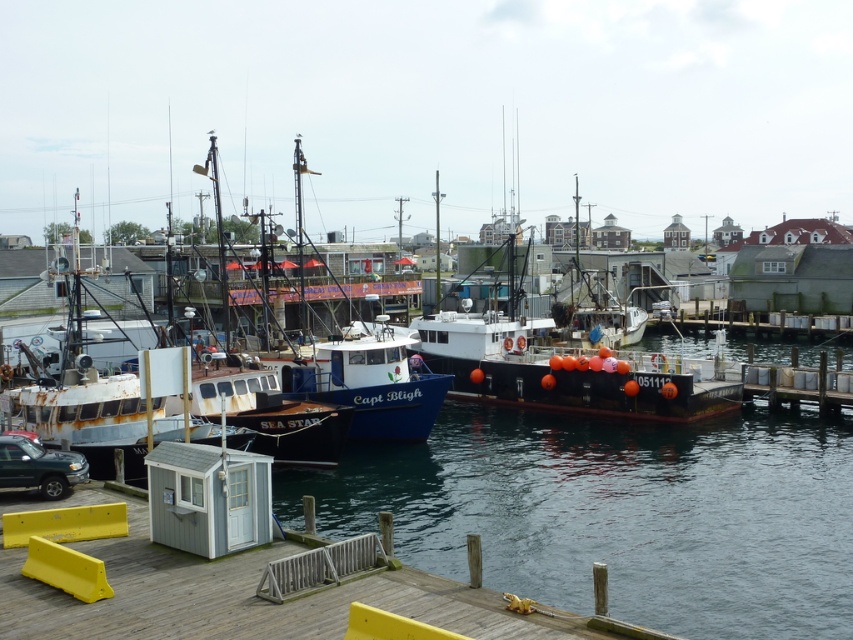
You are standing at the point with coordinates [250,593] in the harbor scene. What object is located exactly at this point?

The wooden dock at lower left is located exactly at point [250,593].

You are a delivery driver who needs to unload a trailer attached to your metallic green truck at lower left onto the wooden dock at lower left. Can you fit the trailer onto the dock without overhanging the edge?

The wooden dock at lower left might be wider than metallic green truck at lower left, so it is possible that the trailer can fit without overhanging, but there is uncertainty due to the comparative width not being definitively stated.